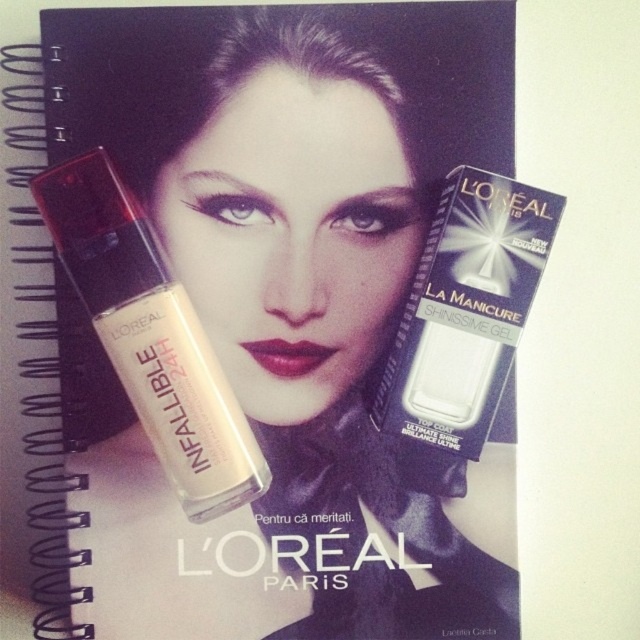
Based on the photo, can you confirm if matte plastic foundation at center is positioned below shiny gel nail polish at upper right?

Yes, matte plastic foundation at center is below shiny gel nail polish at upper right.

Can you confirm if matte plastic foundation at center is positioned to the right of shiny gel nail polish at upper right?

No, matte plastic foundation at center is not to the right of shiny gel nail polish at upper right.

Measure the distance between matte plastic foundation at center and camera.

matte plastic foundation at center and camera are 3.39 feet apart.

Find the location of `matte plastic foundation at center`. matte plastic foundation at center is located at coordinates (150, 337).

Which of these two, matte plastic foundation at center or matte pink lipstick at center, stands shorter?

Standing shorter between the two is matte pink lipstick at center.

The image size is (640, 640). Find the location of `matte plastic foundation at center`. matte plastic foundation at center is located at coordinates (x=150, y=337).

Between point (468, 260) and point (323, 358), which one is positioned in front?

Positioned in front is point (468, 260).

Between point (490, 317) and point (307, 346), which one is positioned behind?

The point (307, 346) is behind.

What do you see at coordinates (465, 310) in the screenshot? Image resolution: width=640 pixels, height=640 pixels. I see `shiny gel nail polish at upper right` at bounding box center [465, 310].

Locate an element on the screen. The image size is (640, 640). shiny gel nail polish at upper right is located at coordinates (465, 310).